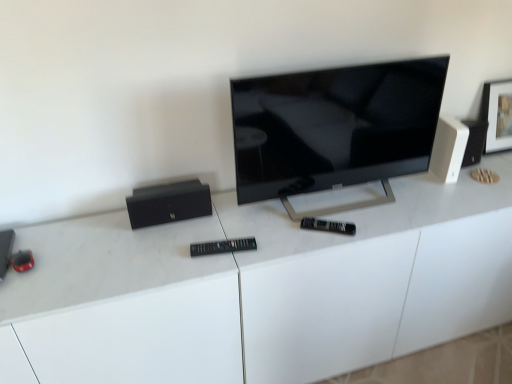
At what (x,y) coordinates should I click in order to perform the action: click on vacant area that lies between black plastic remote at center and metallic black speaker at left, positioned as the 1th speaker in bottom-to-top order. Please return your answer as a coordinate pair (x, y). Image resolution: width=512 pixels, height=384 pixels. Looking at the image, I should click on (101, 260).